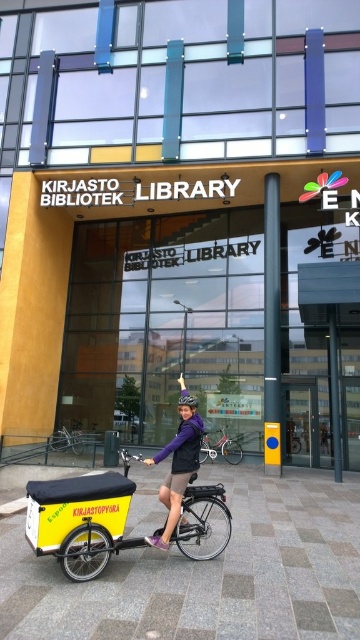
Question: Among these points, which one is nearest to the camera?

Choices:
 (A) (185, 390)
 (B) (216, 504)

Answer: (B)

Question: Can you confirm if purple fabric jacket at center is bigger than silver metallic bicycle at lower left?

Choices:
 (A) no
 (B) yes

Answer: (A)

Question: Which point is farther from the camera taking this photo?

Choices:
 (A) (180, 484)
 (B) (240, 445)
 (C) (82, 444)

Answer: (C)

Question: Which of the following is the closest to the observer?

Choices:
 (A) silver metallic bicycle at lower left
 (B) metallic silver bicycle at center
 (C) yellow matte cargo bike at lower left
 (D) purple fabric jacket at center

Answer: (C)

Question: Is metallic silver bicycle at center to the right of silver metallic bicycle at lower left from the viewer's perspective?

Choices:
 (A) yes
 (B) no

Answer: (A)

Question: Can you confirm if yellow matte cargo bike at lower left is thinner than purple fabric jacket at center?

Choices:
 (A) no
 (B) yes

Answer: (A)